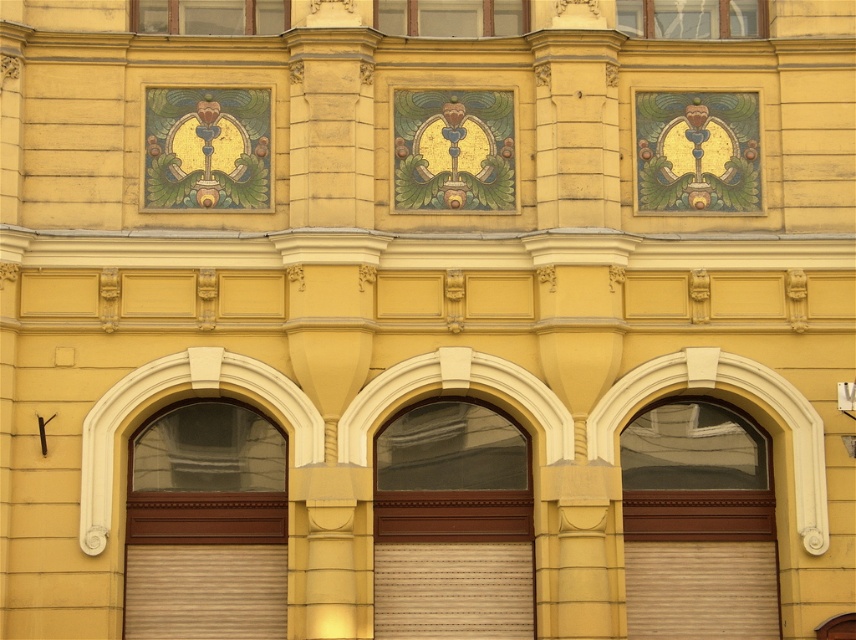
Question: Which object appears farthest from the camera in this image?

Choices:
 (A) matte glass window at upper center
 (B) brown metallic roller door at lower right
 (C) matte glass window at center
 (D) brown wooden garage door at center

Answer: (C)

Question: Which object is positioned farthest from the matte glass window at center?

Choices:
 (A) transparent glass window at upper center
 (B) brown metallic roller door at lower right
 (C) matte glass window at upper center

Answer: (B)

Question: Is brown metallic roller door at lower right closer to camera compared to transparent glass window at upper center?

Choices:
 (A) yes
 (B) no

Answer: (A)

Question: Can you confirm if brown wooden garage door at center is wider than transparent glass window at upper center?

Choices:
 (A) yes
 (B) no

Answer: (B)

Question: Which of the following is the closest to the observer?

Choices:
 (A) brown wooden garage door at center
 (B) brown metallic roller door at lower right
 (C) matte glass window at upper center

Answer: (A)

Question: Observing the image, what is the correct spatial positioning of transparent glass window at upper center in reference to matte glass window at center?

Choices:
 (A) right
 (B) left

Answer: (A)